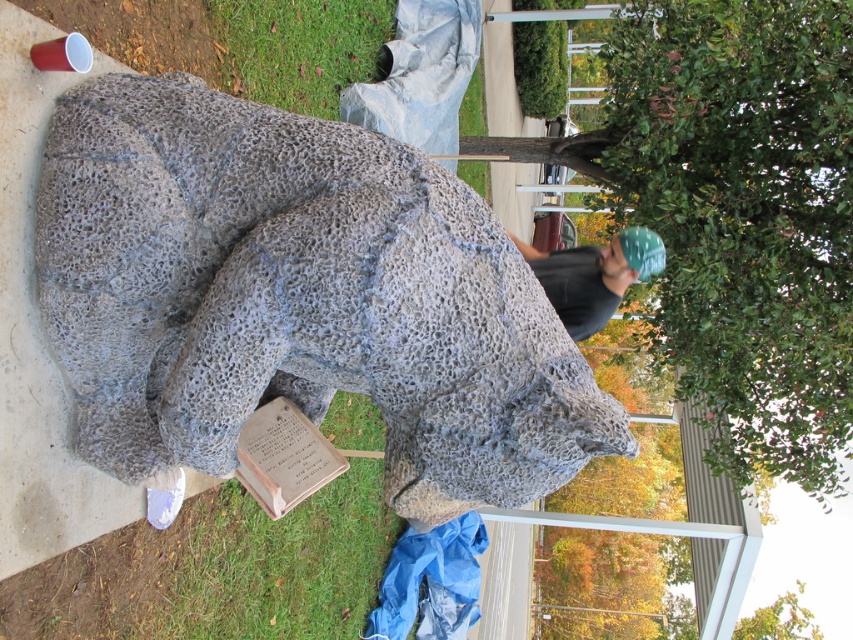
Question: Estimate the real-world distances between objects in this image. Which object is closer to the dark gray textured fabric at center?

Choices:
 (A) brown stone plaque at lower center
 (B) green grass at lower center
 (C) gray textured sculpture at center

Answer: (B)

Question: Which point appears farthest from the camera in this image?

Choices:
 (A) (329, 465)
 (B) (451, 458)
 (C) (621, 275)
 (D) (198, 596)

Answer: (C)

Question: Does gray textured sculpture at center appear on the right side of dark gray textured fabric at center?

Choices:
 (A) yes
 (B) no

Answer: (B)

Question: Can you confirm if gray textured sculpture at center is wider than dark gray textured fabric at center?

Choices:
 (A) no
 (B) yes

Answer: (B)

Question: Based on their relative distances, which object is farther from the dark gray textured fabric at center?

Choices:
 (A) green grass at lower center
 (B) gray textured sculpture at center
 (C) brown stone plaque at lower center

Answer: (B)

Question: Does green grass at lower center appear under brown stone plaque at lower center?

Choices:
 (A) yes
 (B) no

Answer: (A)